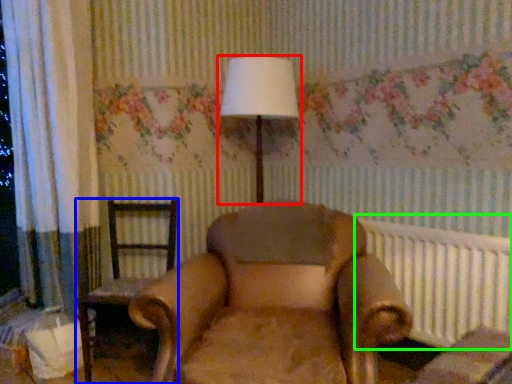
Question: Based on their relative distances, which object is farther from lamp (highlighted by a red box)? Choose from chair (highlighted by a blue box) and radiator (highlighted by a green box).

Choices:
 (A) chair
 (B) radiator

Answer: (B)